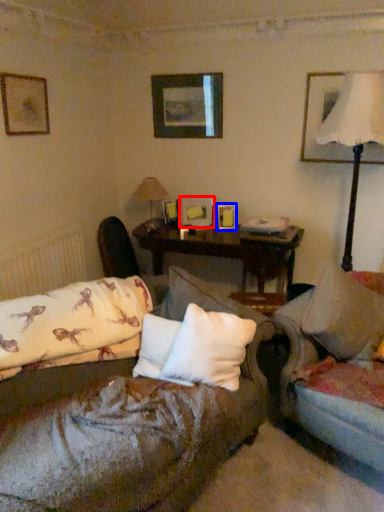
Question: Which object is closer to the camera taking this photo, picture frame (highlighted by a red box) or picture frame (highlighted by a blue box)?

Choices:
 (A) picture frame
 (B) picture frame

Answer: (B)